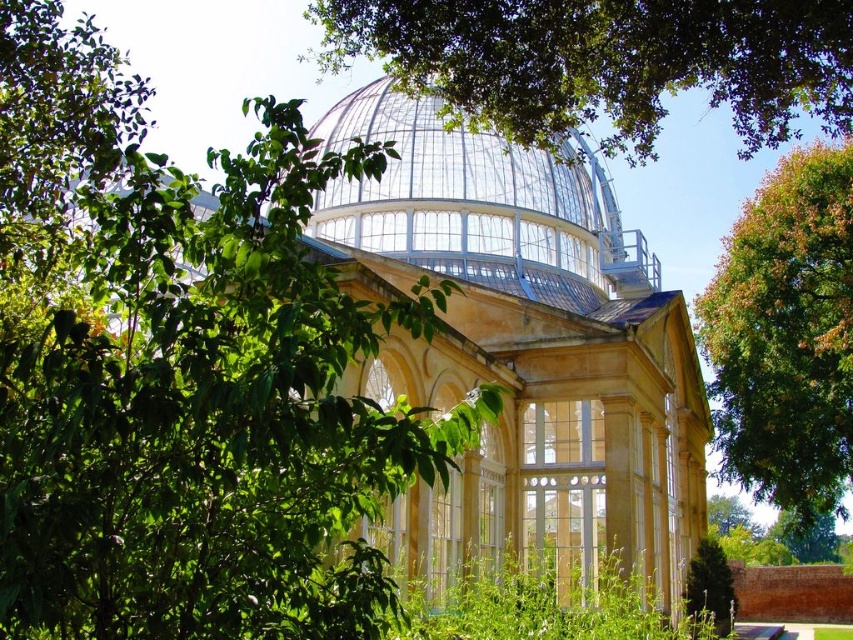
Does matte glass dome at center have a larger size compared to green leafy tree at right?

Indeed, matte glass dome at center has a larger size compared to green leafy tree at right.

Is point (440, 188) more distant than point (735, 300)?

No, (440, 188) is in front of (735, 300).

Identify the location of matte glass dome at center. This screenshot has width=853, height=640. (521, 349).

Image resolution: width=853 pixels, height=640 pixels. I want to click on matte glass dome at center, so click(521, 349).

At what (x,y) coordinates should I click in order to perform the action: click on matte glass dome at center. Please return your answer as a coordinate pair (x, y). This screenshot has width=853, height=640. Looking at the image, I should click on pos(521,349).

Where is `matte glass dome at center`? The height and width of the screenshot is (640, 853). matte glass dome at center is located at coordinates (521, 349).

Is matte glass dome at center thinner than clear glass dome at center?

In fact, matte glass dome at center might be wider than clear glass dome at center.

In the scene shown: Who is more distant from viewer, (602, 394) or (614, 268)?

Point (614, 268)

Is point (587, 154) behind point (492, 230)?

Yes, it is behind point (492, 230).

At what (x,y) coordinates should I click in order to perform the action: click on matte glass dome at center. Please return your answer as a coordinate pair (x, y). The image size is (853, 640). Looking at the image, I should click on (521, 349).